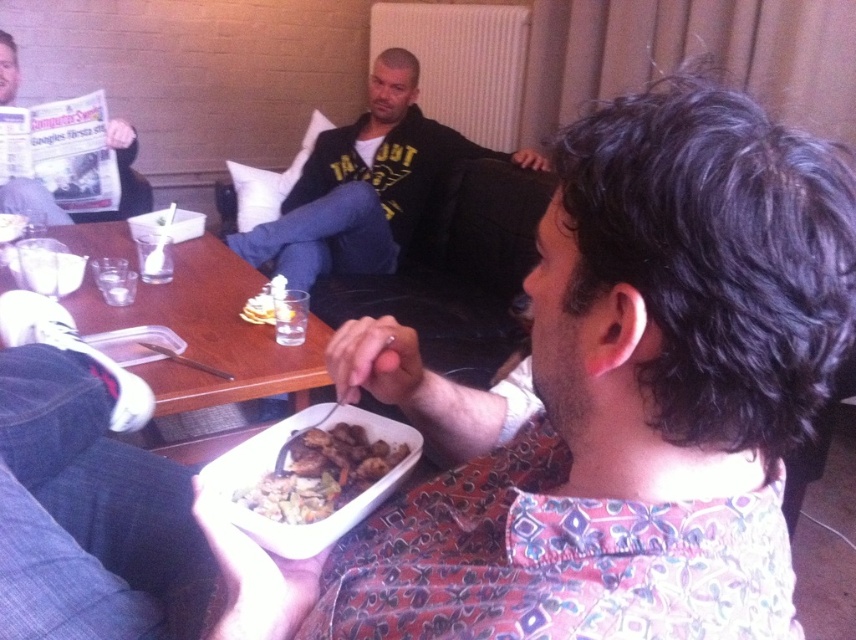
Does dark blue jeans at center appear on the right side of wooden table at center?

Indeed, dark blue jeans at center is positioned on the right side of wooden table at center.

Between dark blue jeans at center and wooden table at center, which one is positioned lower?

wooden table at center

Measure the distance between point [245,241] and camera.

Point [245,241] is 2.58 meters from camera.

At what (x,y) coordinates should I click in order to perform the action: click on dark blue jeans at center. Please return your answer as a coordinate pair (x, y). The width and height of the screenshot is (856, 640). Looking at the image, I should click on (364, 186).

Does point (96, 237) come behind point (81, 212)?

No.

Between wooden table at center and matte black newspaper at upper left, which one has less height?

matte black newspaper at upper left is shorter.

I want to click on wooden table at center, so click(x=209, y=332).

Locate an element on the screen. wooden table at center is located at coordinates (209, 332).

Is point (205, 324) positioned behind point (379, 452)?

Yes, it is behind point (379, 452).

The image size is (856, 640). In order to click on wooden table at center in this screenshot , I will do `click(209, 332)`.